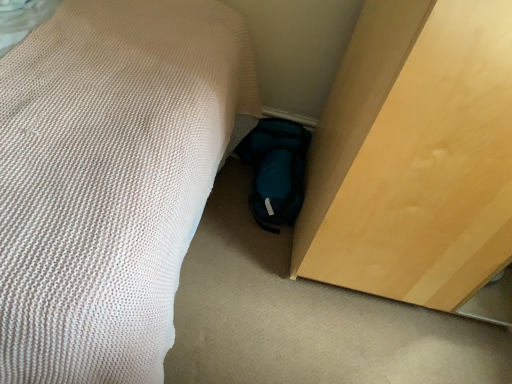
The image size is (512, 384). What do you see at coordinates (110, 179) in the screenshot? I see `white textured bed at lower left` at bounding box center [110, 179].

Find the location of `light wood cabinet at lower right`. light wood cabinet at lower right is located at coordinates (414, 155).

At what (x,y) coordinates should I click in order to perform the action: click on teal fabric slipper at lower center. Please return your answer as a coordinate pair (x, y). The width and height of the screenshot is (512, 384). Looking at the image, I should click on (276, 170).

Find the location of `white textured bed at lower left`. white textured bed at lower left is located at coordinates (110, 179).

Does teal fabric slipper at lower center lie behind light wood cabinet at lower right?

Yes, it is behind light wood cabinet at lower right.

Is teal fabric slipper at lower center not within light wood cabinet at lower right?

Yes.

Between teal fabric slipper at lower center and light wood cabinet at lower right, which one has smaller width?

Thinner between the two is teal fabric slipper at lower center.

Considering the positions of points (244, 160) and (477, 195), is point (244, 160) farther from camera compared to point (477, 195)?

Yes, point (244, 160) is behind point (477, 195).

Is the depth of light wood cabinet at lower right less than that of teal fabric slipper at lower center?

Yes, light wood cabinet at lower right is in front of teal fabric slipper at lower center.

Which is in front, point (308, 223) or point (255, 213)?

The point (308, 223) is more forward.

Considering the positions of objects light wood cabinet at lower right and teal fabric slipper at lower center in the image provided, who is more to the right, light wood cabinet at lower right or teal fabric slipper at lower center?

Positioned to the right is light wood cabinet at lower right.

Which is more to the left, white textured bed at lower left or light wood cabinet at lower right?

white textured bed at lower left is more to the left.

Does white textured bed at lower left lie in front of light wood cabinet at lower right?

Yes, it is in front of light wood cabinet at lower right.

Which of these two, white textured bed at lower left or light wood cabinet at lower right, stands taller?

light wood cabinet at lower right.

Between light wood cabinet at lower right and white textured bed at lower left, which one has larger size?

With larger size is white textured bed at lower left.

From a real-world perspective, which object rests below the other?

From a 3D spatial view, white textured bed at lower left is below.

In the image, is light wood cabinet at lower right positioned in front of or behind white textured bed at lower left?

Clearly, light wood cabinet at lower right is behind white textured bed at lower left.

Can you confirm if teal fabric slipper at lower center is positioned to the right of white textured bed at lower left?

Yes.

Between teal fabric slipper at lower center and white textured bed at lower left, which one has smaller width?

teal fabric slipper at lower center.

In terms of size, does teal fabric slipper at lower center appear bigger or smaller than white textured bed at lower left?

teal fabric slipper at lower center is smaller than white textured bed at lower left.

From a real-world perspective, which is physically below, teal fabric slipper at lower center or white textured bed at lower left?

teal fabric slipper at lower center.

From a real-world perspective, is white textured bed at lower left physically located above or below teal fabric slipper at lower center?

white textured bed at lower left is above teal fabric slipper at lower center.

Is white textured bed at lower left aimed at teal fabric slipper at lower center?

Yes, white textured bed at lower left is facing teal fabric slipper at lower center.

From the image's perspective, which is above, white textured bed at lower left or teal fabric slipper at lower center?

white textured bed at lower left appears higher in the image.

This screenshot has width=512, height=384. In order to click on footwear behind the light wood cabinet at lower right in this screenshot , I will do `click(276, 170)`.

The width and height of the screenshot is (512, 384). Find the location of `footwear that is on the left side of light wood cabinet at lower right`. footwear that is on the left side of light wood cabinet at lower right is located at coordinates (276, 170).

Estimate the real-world distances between objects in this image. Which object is further from light wood cabinet at lower right, white textured bed at lower left or teal fabric slipper at lower center?

The object further to light wood cabinet at lower right is white textured bed at lower left.

From the image, which object appears to be nearer to white textured bed at lower left, light wood cabinet at lower right or teal fabric slipper at lower center?

light wood cabinet at lower right is positioned closer to the anchor white textured bed at lower left.

Which object lies further to the anchor point teal fabric slipper at lower center, light wood cabinet at lower right or white textured bed at lower left?

The object further to teal fabric slipper at lower center is white textured bed at lower left.

From the image, which object appears to be nearer to white textured bed at lower left, teal fabric slipper at lower center or light wood cabinet at lower right?

light wood cabinet at lower right.

Estimate the real-world distances between objects in this image. Which object is further from teal fabric slipper at lower center, white textured bed at lower left or light wood cabinet at lower right?

The object further to teal fabric slipper at lower center is white textured bed at lower left.

Looking at the image, which one is located closer to light wood cabinet at lower right, teal fabric slipper at lower center or white textured bed at lower left?

teal fabric slipper at lower center is positioned closer to the anchor light wood cabinet at lower right.

Locate an element on the screen. footwear located between white textured bed at lower left and light wood cabinet at lower right in the left-right direction is located at coordinates (276, 170).